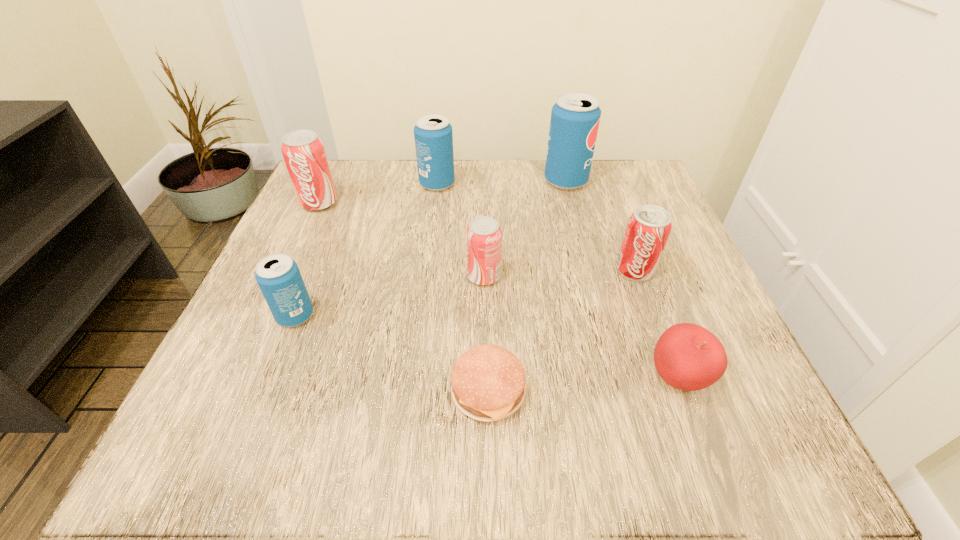
Find the location of a particular element. Image resolution: width=960 pixels, height=540 pixels. vacant region at the left edge of the desktop is located at coordinates (308, 322).

You are a GUI agent. You are given a task and a screenshot of the screen. Output one action in this format:
    pyautogui.click(x=<x>, y=<y>)
    Task: Click on the vacant area at the right edge
    This screenshot has width=960, height=540.
    Given the screenshot: What is the action you would take?
    pyautogui.click(x=669, y=325)

Find the location of `vacant area at the far left corner`. vacant area at the far left corner is located at coordinates (347, 195).

The height and width of the screenshot is (540, 960). In the image, there is a desktop. Identify the location of free space at the near left corner. (248, 436).

The width and height of the screenshot is (960, 540). Identify the location of free space at the far right corner of the desktop. (611, 190).

In the image, there is a desktop. Find the location of `vacant space at the near right corner`. vacant space at the near right corner is located at coordinates (700, 462).

At what (x,y) coordinates should I click in order to perform the action: click on vacant space that is in between the rightmost red soda can and the fourth soda can from right to left. Please return your answer as a coordinate pair (x, y). Looking at the image, I should click on (536, 227).

You are a GUI agent. You are given a task and a screenshot of the screen. Output one action in this format:
    pyautogui.click(x=<x>, y=<y>)
    Task: Click on the unoccupied position between the smallest blue soda can and the second biggest blue soda can
    This screenshot has height=540, width=960.
    Given the screenshot: What is the action you would take?
    pyautogui.click(x=367, y=250)

Locate an element on the screen. The width and height of the screenshot is (960, 540). free space between the second red soda can from left to right and the smallest blue soda can is located at coordinates (390, 296).

The image size is (960, 540). In order to click on free space between the rightmost red soda can and the tallest object in this screenshot , I will do `click(600, 226)`.